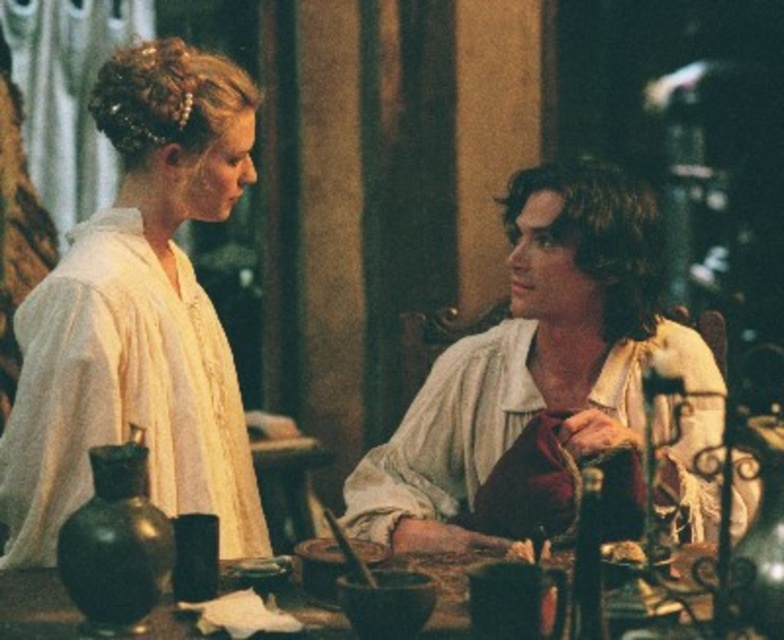
Question: Which of the following is the closest to the observer?

Choices:
 (A) (13, 628)
 (B) (107, 83)
 (C) (487, 384)

Answer: (A)

Question: Is velvet maroon robe at right wider than wooden table at center?

Choices:
 (A) yes
 (B) no

Answer: (B)

Question: Which point is closer to the camera?

Choices:
 (A) click(x=35, y=634)
 (B) click(x=387, y=484)

Answer: (A)

Question: Which of the following is the closest to the observer?

Choices:
 (A) (187, 509)
 (B) (45, 570)

Answer: (B)

Question: Can you confirm if velvet maroon robe at right is positioned below wooden table at center?

Choices:
 (A) yes
 (B) no

Answer: (B)

Question: Does velvet maroon robe at right have a smaller size compared to wooden table at center?

Choices:
 (A) yes
 (B) no

Answer: (B)